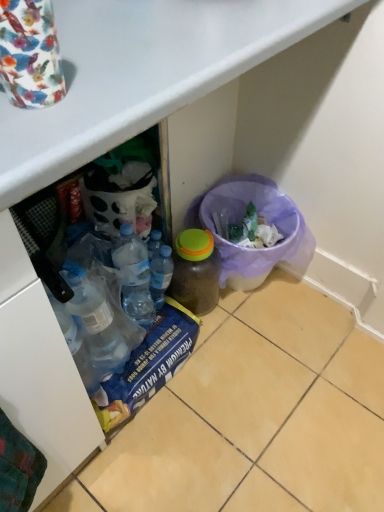
Question: Does purple mesh bin at lower right appear on the left side of translucent plastic bottle at center, placed as the 2th bottle when sorted from left to right?

Choices:
 (A) yes
 (B) no

Answer: (B)

Question: Is purple mesh bin at lower right facing away from translucent plastic bottle at center, the 1th bottle from the right?

Choices:
 (A) yes
 (B) no

Answer: (B)

Question: From the image's perspective, does purple mesh bin at lower right appear higher than translucent plastic bottle at center, placed as the 2th bottle when sorted from left to right?

Choices:
 (A) yes
 (B) no

Answer: (A)

Question: Is purple mesh bin at lower right at the right side of translucent plastic bottle at center, placed as the 2th bottle when sorted from left to right?

Choices:
 (A) no
 (B) yes

Answer: (B)

Question: Is purple mesh bin at lower right behind translucent plastic bottle at center, placed as the 2th bottle when sorted from left to right?

Choices:
 (A) yes
 (B) no

Answer: (A)

Question: Is purple mesh bin at lower right aimed at translucent plastic bottle at center, placed as the 2th bottle when sorted from left to right?

Choices:
 (A) no
 (B) yes

Answer: (A)

Question: Is translucent plastic bottle at center, placed as the 2th bottle when sorted from left to right, looking in the opposite direction of transparent plastic bottle at center, which appears as the 2th bottle when viewed from the right?

Choices:
 (A) no
 (B) yes

Answer: (A)

Question: From a real-world perspective, does translucent plastic bottle at center, placed as the 2th bottle when sorted from left to right, sit lower than transparent plastic bottle at center, which appears as the 2th bottle when viewed from the right?

Choices:
 (A) no
 (B) yes

Answer: (B)

Question: Does translucent plastic bottle at center, placed as the 2th bottle when sorted from left to right, have a lesser width compared to transparent plastic bottle at center, which appears as the 2th bottle when viewed from the right?

Choices:
 (A) no
 (B) yes

Answer: (A)

Question: Can you confirm if translucent plastic bottle at center, the 1th bottle from the right, is wider than transparent plastic bottle at center, acting as the 1th bottle starting from the left?

Choices:
 (A) no
 (B) yes

Answer: (B)

Question: From a real-world perspective, is translucent plastic bottle at center, the 1th bottle from the right, over transparent plastic bottle at center, which appears as the 2th bottle when viewed from the right?

Choices:
 (A) yes
 (B) no

Answer: (B)

Question: Does translucent plastic bottle at center, the 1th bottle from the right, appear on the left side of transparent plastic bottle at center, which appears as the 2th bottle when viewed from the right?

Choices:
 (A) no
 (B) yes

Answer: (A)

Question: Could you tell me if purple mesh bin at lower right is turned towards transparent plastic bottle at center, which appears as the 2th bottle when viewed from the right?

Choices:
 (A) no
 (B) yes

Answer: (A)